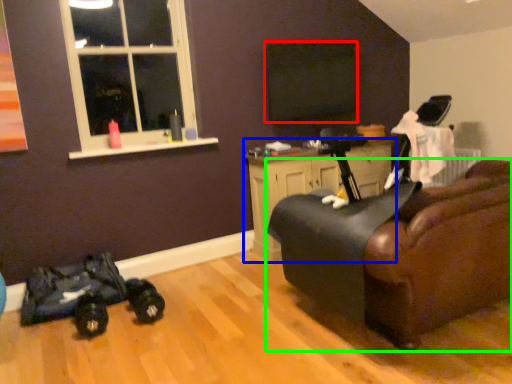
Question: Based on their relative distances, which object is farther from window screen (highlighted by a red box)? Choose from cabinetry (highlighted by a blue box) and chair (highlighted by a green box).

Choices:
 (A) cabinetry
 (B) chair

Answer: (B)